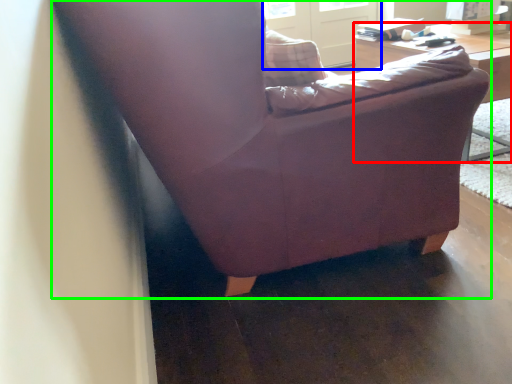
Question: Estimate the real-world distances between objects in this image. Which object is farther from table (highlighted by a red box), screen door (highlighted by a blue box) or chair (highlighted by a green box)?

Choices:
 (A) screen door
 (B) chair

Answer: (A)